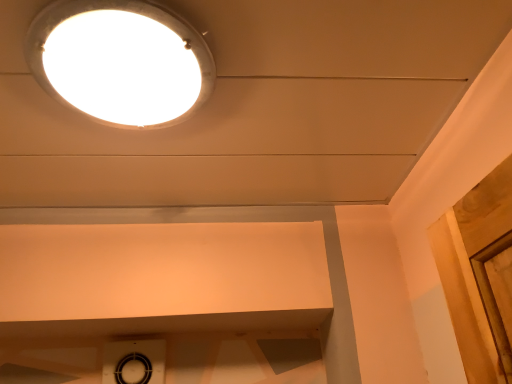
Find the location of a particular element. white glossy lamp at upper center is located at coordinates (120, 61).

What do you see at coordinates (120, 61) in the screenshot?
I see `white glossy lamp at upper center` at bounding box center [120, 61].

Locate an element on the screen. The width and height of the screenshot is (512, 384). white glossy lamp at upper center is located at coordinates (120, 61).